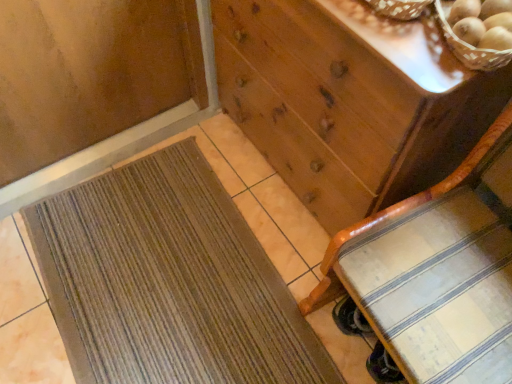
Question: Considering the relative positions of brown textured mat at lower left and wooden chest of drawers at center in the image provided, is brown textured mat at lower left to the right of wooden chest of drawers at center from the viewer's perspective?

Choices:
 (A) yes
 (B) no

Answer: (B)

Question: Does brown textured mat at lower left have a greater width compared to wooden chest of drawers at center?

Choices:
 (A) no
 (B) yes

Answer: (B)

Question: Is brown textured mat at lower left turned away from wooden chest of drawers at center?

Choices:
 (A) no
 (B) yes

Answer: (B)

Question: Is brown textured mat at lower left with wooden chest of drawers at center?

Choices:
 (A) yes
 (B) no

Answer: (B)

Question: From the image's perspective, is brown textured mat at lower left located above wooden chest of drawers at center?

Choices:
 (A) no
 (B) yes

Answer: (A)

Question: Is brown textured mat at lower left far away from wooden chest of drawers at center?

Choices:
 (A) no
 (B) yes

Answer: (A)

Question: Can you confirm if wooden chest of drawers at center is bigger than wooden chair at lower right?

Choices:
 (A) yes
 (B) no

Answer: (A)

Question: From a real-world perspective, is wooden chest of drawers at center under wooden chair at lower right?

Choices:
 (A) no
 (B) yes

Answer: (B)

Question: Is the depth of wooden chest of drawers at center greater than that of wooden chair at lower right?

Choices:
 (A) no
 (B) yes

Answer: (B)

Question: Would you say wooden chest of drawers at center is outside wooden chair at lower right?

Choices:
 (A) yes
 (B) no

Answer: (A)

Question: Is wooden chest of drawers at center thinner than wooden chair at lower right?

Choices:
 (A) yes
 (B) no

Answer: (A)

Question: Does wooden chest of drawers at center have a greater height compared to wooden chair at lower right?

Choices:
 (A) yes
 (B) no

Answer: (B)

Question: Considering the relative sizes of wooden woven basket at upper right and brown textured mat at lower left in the image provided, is wooden woven basket at upper right shorter than brown textured mat at lower left?

Choices:
 (A) no
 (B) yes

Answer: (A)